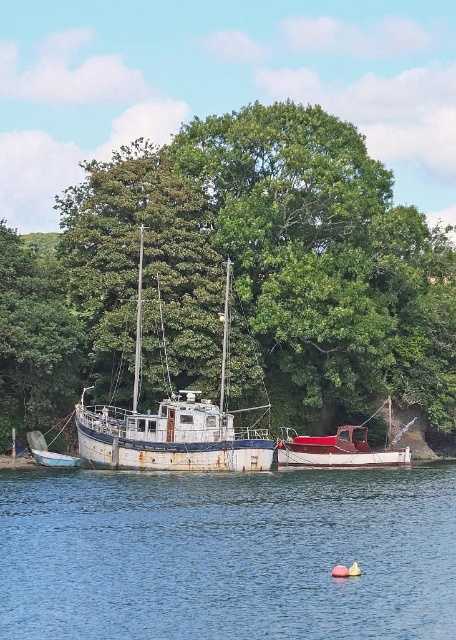
Which is below, blue water at center or rusty metal boat at lower left?

Positioned lower is blue water at center.

Is point (399, 596) in front of point (43, 442)?

Yes, it is.

The image size is (456, 640). What are the coordinates of `blue water at center` in the screenshot? It's located at (228, 554).

Does point (305, 444) come in front of point (60, 458)?

No, (305, 444) is behind (60, 458).

Does rustic wood boat at center appear on the right side of rusty metal boat at lower left?

Correct, you'll find rustic wood boat at center to the right of rusty metal boat at lower left.

Does point (330, 436) come behind point (26, 438)?

That is True.

At what (x,y) coordinates should I click in order to perform the action: click on rustic wood boat at center. Please return your answer as a coordinate pair (x, y). Image resolution: width=456 pixels, height=640 pixels. Looking at the image, I should click on (340, 449).

Between green leafy tree at center and rusty metal boat at lower left, which one is positioned lower?

rusty metal boat at lower left is lower down.

Looking at this image, between green leafy tree at center and rusty metal boat at lower left, which one appears on the right side from the viewer's perspective?

Positioned to the right is green leafy tree at center.

What are the coordinates of `green leafy tree at center` in the screenshot? It's located at tap(236, 276).